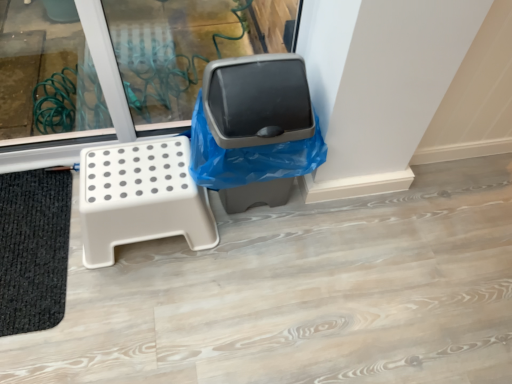
The image size is (512, 384). Find the location of `blank space situated above white plastic stool at left (from a real-world perspective)`. blank space situated above white plastic stool at left (from a real-world perspective) is located at coordinates (136, 175).